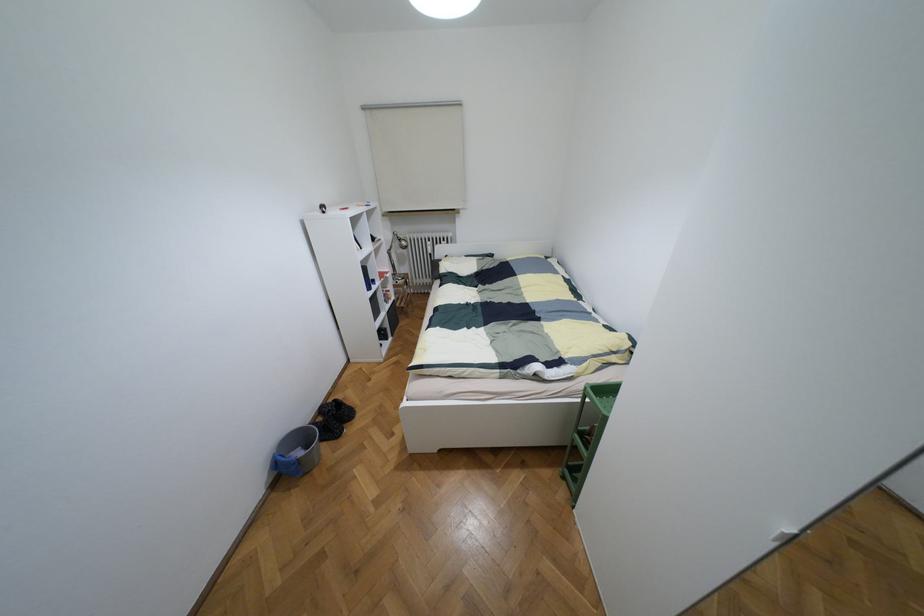
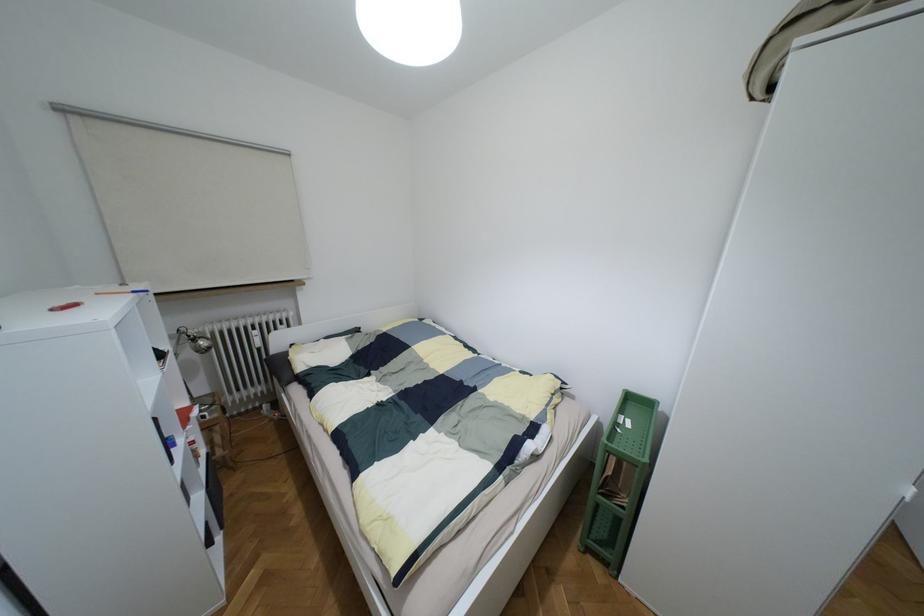
Question: The camera is either moving clockwise (left) or counter-clockwise (right) around the object. The first image is from the beginning of the video and the second image is from the end. Is the camera moving left or right when shooting the video?

Choices:
 (A) Left
 (B) Right

Answer: (A)